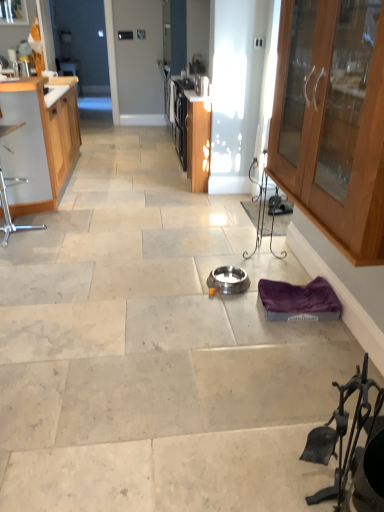
Question: Does black wrought iron fireplace tools at lower right, acting as the second chair starting from the back, appear on the left side of wooden cabinet at right, which ranks as the 1th cabinetry in right-to-left order?

Choices:
 (A) no
 (B) yes

Answer: (B)

Question: Is black wrought iron fireplace tools at lower right, which is the first chair from front to back, looking in the opposite direction of wooden cabinet at right, which is the first cabinetry from front to back?

Choices:
 (A) yes
 (B) no

Answer: (B)

Question: From the image's perspective, does black wrought iron fireplace tools at lower right, acting as the second chair starting from the back, appear lower than wooden cabinet at right, which ranks as the 1th cabinetry in right-to-left order?

Choices:
 (A) no
 (B) yes

Answer: (B)

Question: Is black wrought iron fireplace tools at lower right, acting as the second chair starting from the back, completely or partially outside of wooden cabinet at right, arranged as the 2th cabinetry when viewed from the left?

Choices:
 (A) yes
 (B) no

Answer: (A)

Question: Is black wrought iron fireplace tools at lower right, which is the first chair from front to back, not close to wooden cabinet at right, which ranks as the 1th cabinetry in right-to-left order?

Choices:
 (A) no
 (B) yes

Answer: (A)

Question: Considering the relative sizes of black wrought iron fireplace tools at lower right, the second chair positioned from the left, and wooden cabinet at right, arranged as the 2th cabinetry when viewed from the left, in the image provided, is black wrought iron fireplace tools at lower right, the second chair positioned from the left, wider than wooden cabinet at right, arranged as the 2th cabinetry when viewed from the left,?

Choices:
 (A) yes
 (B) no

Answer: (B)

Question: Does satin silver bowl at center, positioned as the first appliance in bottom-to-top order, appear on the left side of metallic silver chair at left, the second chair from the front?

Choices:
 (A) no
 (B) yes

Answer: (A)

Question: Does satin silver bowl at center, the second appliance viewed from the left, have a smaller size compared to metallic silver chair at left, positioned as the first chair in back-to-front order?

Choices:
 (A) no
 (B) yes

Answer: (B)

Question: Is satin silver bowl at center, the 2th appliance in the top-to-bottom sequence, bigger than metallic silver chair at left, positioned as the first chair in back-to-front order?

Choices:
 (A) yes
 (B) no

Answer: (B)

Question: Does satin silver bowl at center, the 2th appliance in the top-to-bottom sequence, have a lesser height compared to metallic silver chair at left, the 2th chair when ordered from bottom to top?

Choices:
 (A) yes
 (B) no

Answer: (A)

Question: Does satin silver bowl at center, positioned as the first appliance in bottom-to-top order, lie behind metallic silver chair at left, the 2th chair when ordered from bottom to top?

Choices:
 (A) no
 (B) yes

Answer: (A)

Question: Is satin silver bowl at center, arranged as the second appliance when viewed from the back, positioned in front of metallic silver chair at left, which appears as the 1th chair when viewed from the left?

Choices:
 (A) no
 (B) yes

Answer: (B)

Question: Can you confirm if metallic silver chair at left, which appears as the 1th chair when viewed from the left, is shorter than satin silver bowl at center, the 1th appliance from the right?

Choices:
 (A) no
 (B) yes

Answer: (A)